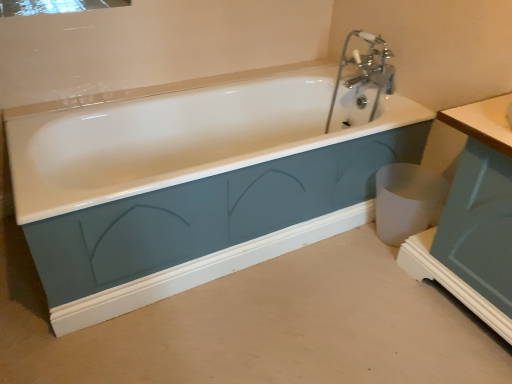
Find the location of `free space in front of white matte trash can at lower right`. free space in front of white matte trash can at lower right is located at coordinates (390, 266).